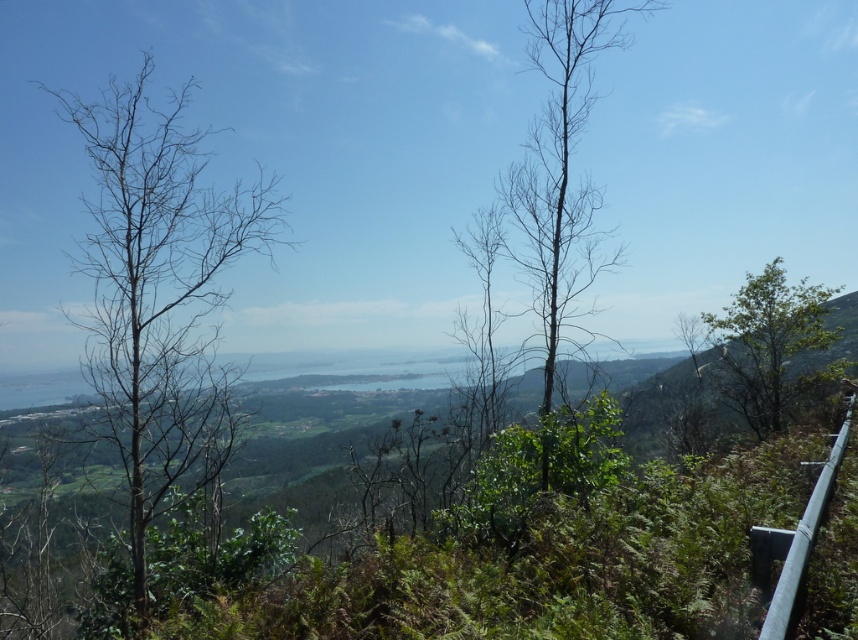
Question: Is green leafy tree at right closer to the viewer compared to silver metallic rail at right?

Choices:
 (A) no
 (B) yes

Answer: (A)

Question: Observing the image, what is the correct spatial positioning of green leafy tree at right in reference to silver metallic rail at right?

Choices:
 (A) above
 (B) below

Answer: (A)

Question: Which point is farther from the camera taking this photo?

Choices:
 (A) pyautogui.click(x=506, y=198)
 (B) pyautogui.click(x=257, y=246)

Answer: (A)

Question: Which object is the farthest from the green leafy tree at right?

Choices:
 (A) bare wood tree at left
 (B) silver metallic rail at right
 (C) bare wood tree at center

Answer: (A)

Question: Is bare wood tree at center in front of silver metallic rail at right?

Choices:
 (A) no
 (B) yes

Answer: (A)

Question: Which point appears farthest from the camera in this image?

Choices:
 (A) (768, 573)
 (B) (575, 285)
 (C) (125, 134)

Answer: (B)